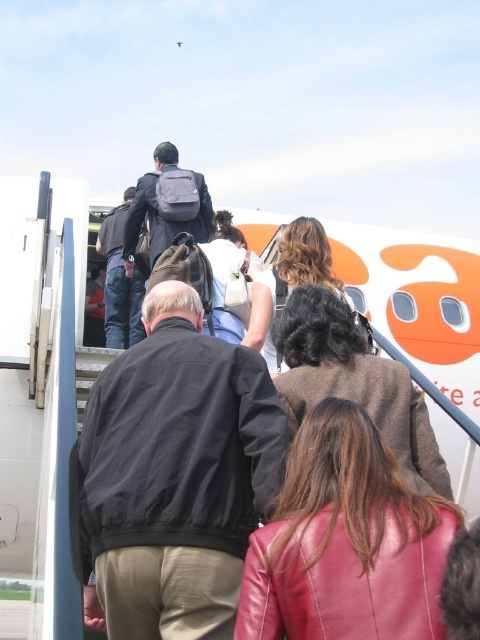
Question: Does black leather jacket at center have a lesser width compared to matte gray backpack at center?

Choices:
 (A) no
 (B) yes

Answer: (A)

Question: Which object is positioned closest to the matte gray backpack at center?

Choices:
 (A) black leather jacket at center
 (B) brown leather jacket at center
 (C) white matte airplane at center

Answer: (C)

Question: Does black leather jacket at center have a lesser width compared to white matte airplane at center?

Choices:
 (A) no
 (B) yes

Answer: (B)

Question: Which point is farther to the camera?

Choices:
 (A) [406, 458]
 (B) [129, 380]
 (C) [137, 237]

Answer: (C)

Question: Which object is closer to the camera taking this photo?

Choices:
 (A) black leather jacket at center
 (B) matte gray backpack at center
 (C) leather jacket at center
 (D) white matte airplane at center

Answer: (D)

Question: Is white matte airplane at center above matte gray backpack at center?

Choices:
 (A) yes
 (B) no

Answer: (B)